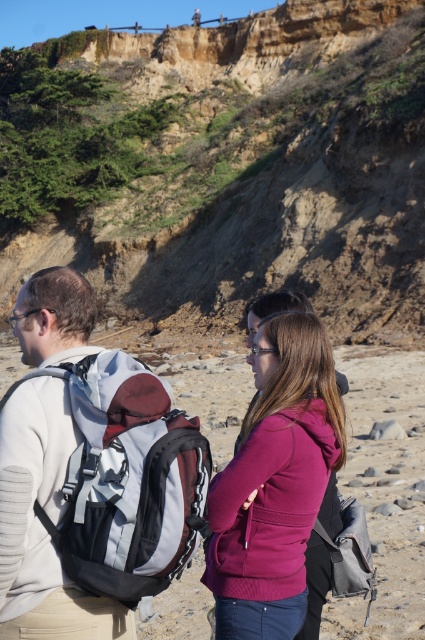
You are planning to take a photo of the two backpacks, the gray fabric backpack at center and the matte black backpack at center, from the perspective of someone standing behind the group on the beach. Which backpack will appear taller in the photo?

The matte black backpack at center will appear taller in the photo because it is taller than the gray fabric backpack at center according to the description.

You are a hiker planning to take a photo of the earthy brown cliff at upper center and the purple fleece jacket at center. Which object should you position closer to the left side of your camera frame?

The earthy brown cliff at upper center should be positioned closer to the left side of your camera frame because it is located to the left of the purple fleece jacket at center.